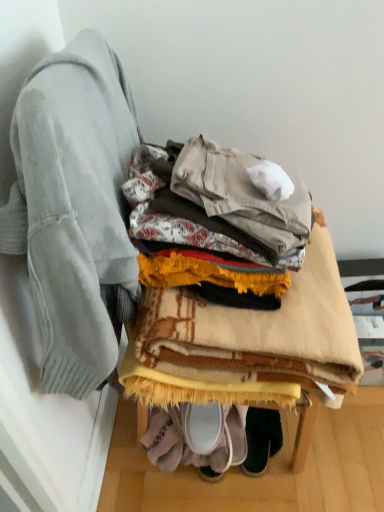
Where is `free point above dark green suede shoes at lower center (from a real-world perspective)`? The height and width of the screenshot is (512, 384). free point above dark green suede shoes at lower center (from a real-world perspective) is located at coordinates (259, 426).